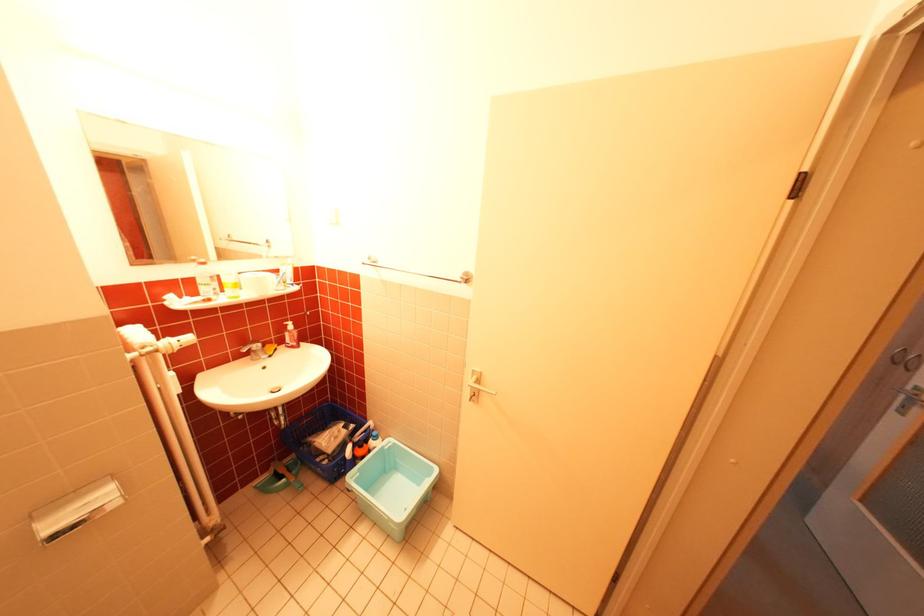
Identify the location of dispenser pump top. This screenshot has width=924, height=616. (290, 333).